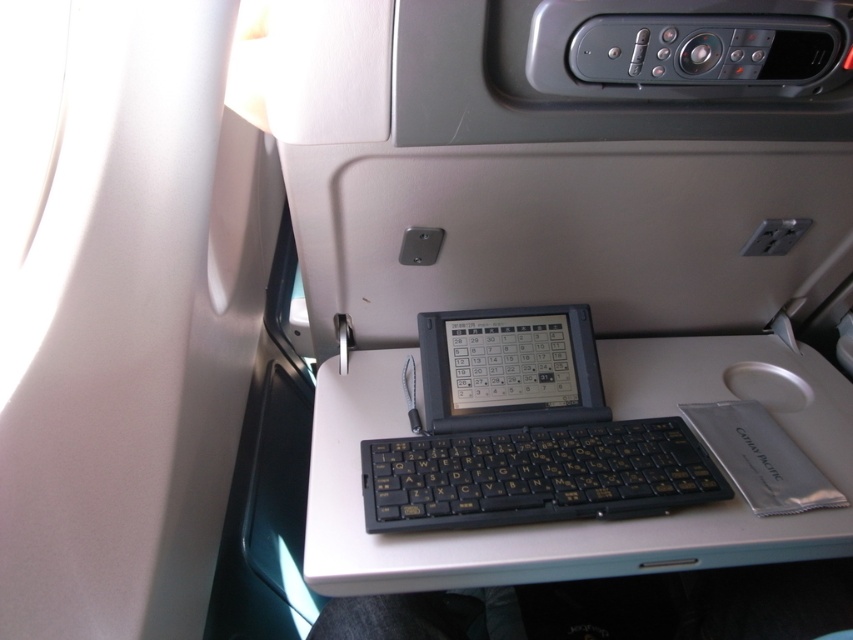
Between black plastic keyboard at center and silver metallic mouse at center, which one has more height?

Standing taller between the two is black plastic keyboard at center.

Who is positioned more to the right, black plastic keyboard at center or silver metallic mouse at center?

From the viewer's perspective, silver metallic mouse at center appears more on the right side.

Which is in front, point (573, 488) or point (792, 384)?

Point (573, 488)

Find the location of a particular element. Image resolution: width=853 pixels, height=640 pixels. black plastic keyboard at center is located at coordinates (537, 476).

Who is shorter, white plastic table at center or silver metallic mouse at center?

silver metallic mouse at center

Measure the distance between white plastic table at center and silver metallic mouse at center.

8.30 inches

Is point (785, 525) more distant than point (804, 385)?

No, it is in front of (804, 385).

Find the location of `white plastic table at center`. white plastic table at center is located at coordinates (573, 520).

Who is lower down, white plastic table at center or black plastic keyboard at center?

black plastic keyboard at center is below.

Is the position of white plastic table at center more distant than that of black plastic keyboard at center?

That is False.

Find the location of a particular element. The width and height of the screenshot is (853, 640). white plastic table at center is located at coordinates (573, 520).

The width and height of the screenshot is (853, 640). What are the coordinates of `white plastic table at center` in the screenshot? It's located at (573, 520).